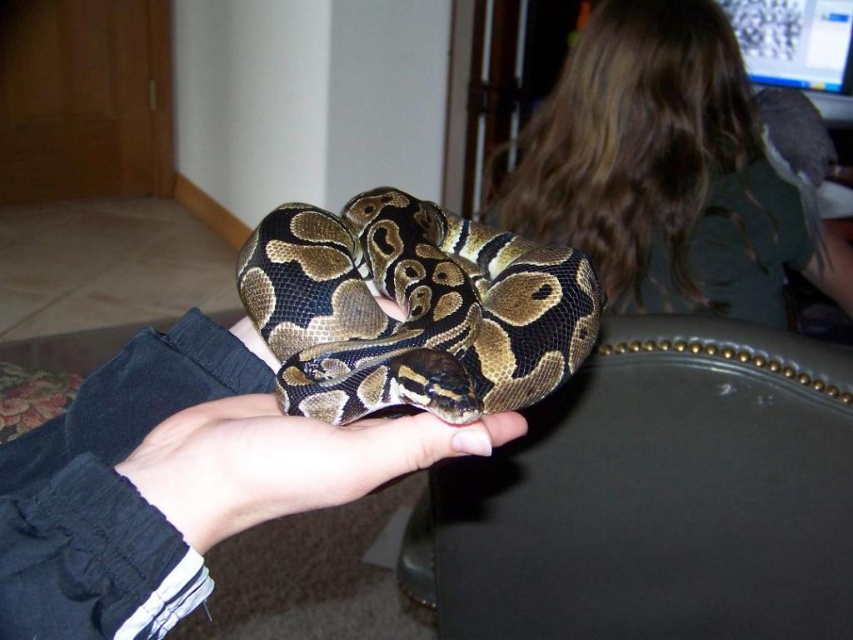
Question: Does smooth brown snake at center have a larger size compared to dark brown hair at upper right?

Choices:
 (A) no
 (B) yes

Answer: (A)

Question: Which point is closer to the camera?

Choices:
 (A) camouflage-patterned snake at center
 (B) dark brown hair at upper right

Answer: (A)

Question: Considering the relative positions of dark brown hair at upper right and camouflage-patterned snake at center in the image provided, where is dark brown hair at upper right located with respect to camouflage-patterned snake at center?

Choices:
 (A) right
 (B) left

Answer: (A)

Question: Does smooth brown snake at center have a smaller size compared to dark brown hair at upper right?

Choices:
 (A) yes
 (B) no

Answer: (A)

Question: Which object is positioned farthest from the dark brown hair at upper right?

Choices:
 (A) camouflage-patterned snake at center
 (B) smooth brown snake at center

Answer: (B)

Question: Based on their relative distances, which object is nearer to the dark brown hair at upper right?

Choices:
 (A) camouflage-patterned snake at center
 (B) smooth brown snake at center

Answer: (A)